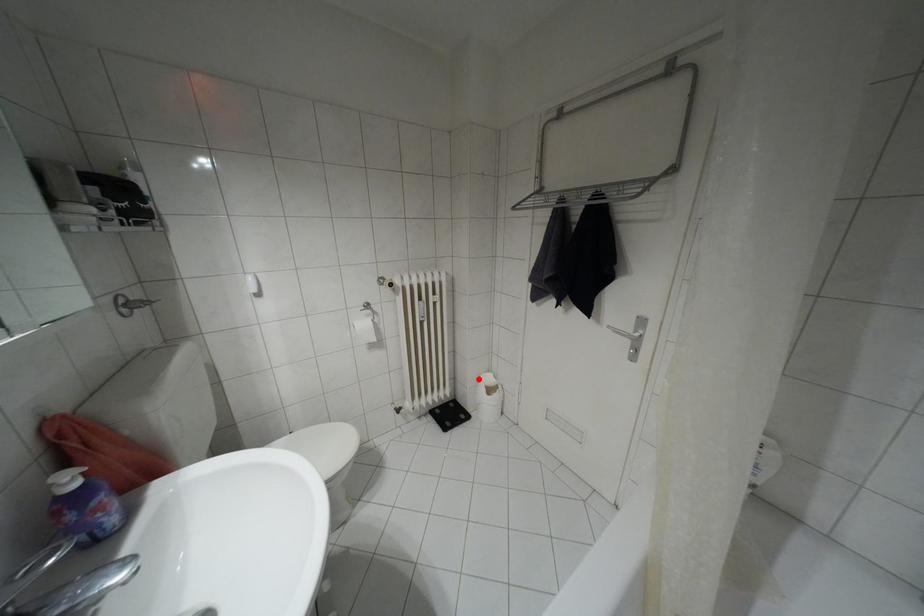
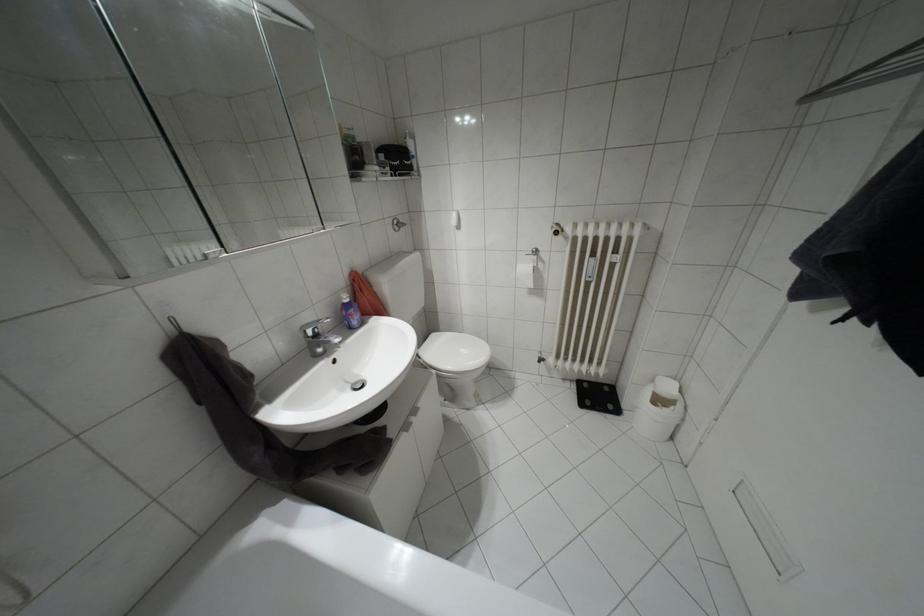
Question: I am providing you with two images of the same scene from different viewpoints. In image1, a red point is highlighted. Considering the same 3D point in image2, which of the following is correct?

Choices:
 (A) It is closer
 (B) It is farther

Answer: (A)